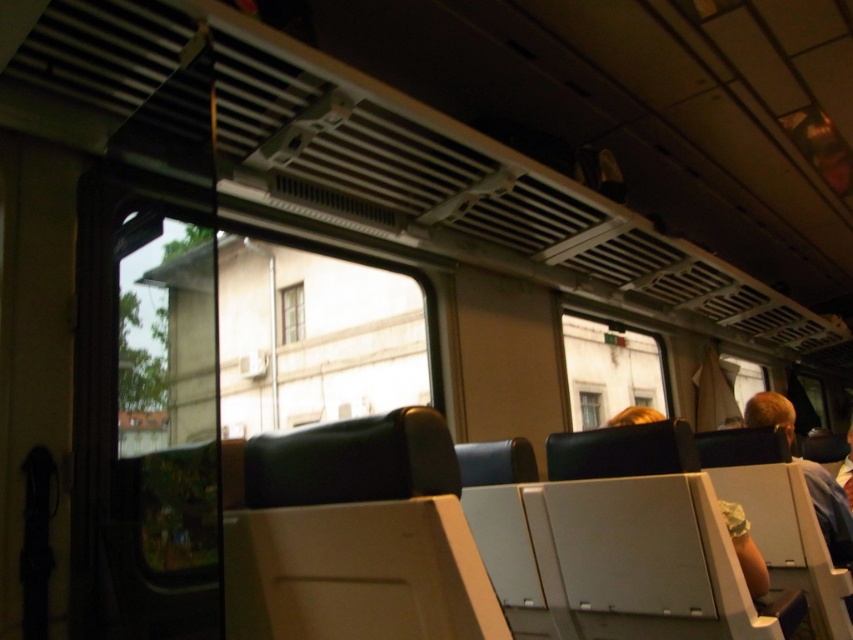
Which of these two, light brown hair at right or clear glass window at center, stands taller?

light brown hair at right is taller.

Does light brown hair at right lie in front of clear glass window at center?

Yes, light brown hair at right is in front of clear glass window at center.

In order to click on light brown hair at right in this screenshot , I will do pos(828,512).

The image size is (853, 640). I want to click on light brown hair at right, so click(x=828, y=512).

Does light brown hair at right have a lesser width compared to light brown leather armrest at center?

In fact, light brown hair at right might be wider than light brown leather armrest at center.

Locate an element on the screen. This screenshot has width=853, height=640. light brown hair at right is located at coordinates (828, 512).

Is point (648, 413) positioned before point (293, 316)?

Yes, it is.

Can you confirm if light brown leather armrest at center is positioned to the left of white wooden window at center?

In fact, light brown leather armrest at center is to the right of white wooden window at center.

Which is in front, point (730, 524) or point (296, 289)?

Point (730, 524) is more forward.

I want to click on light brown leather armrest at center, so click(x=746, y=548).